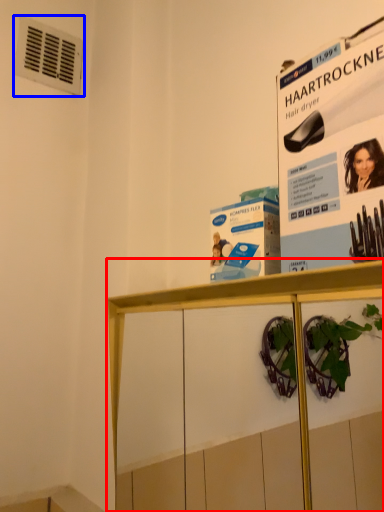
Question: Which object appears closest to the camera in this image, shelf (highlighted by a red box) or air conditioning (highlighted by a blue box)?

Choices:
 (A) shelf
 (B) air conditioning

Answer: (A)